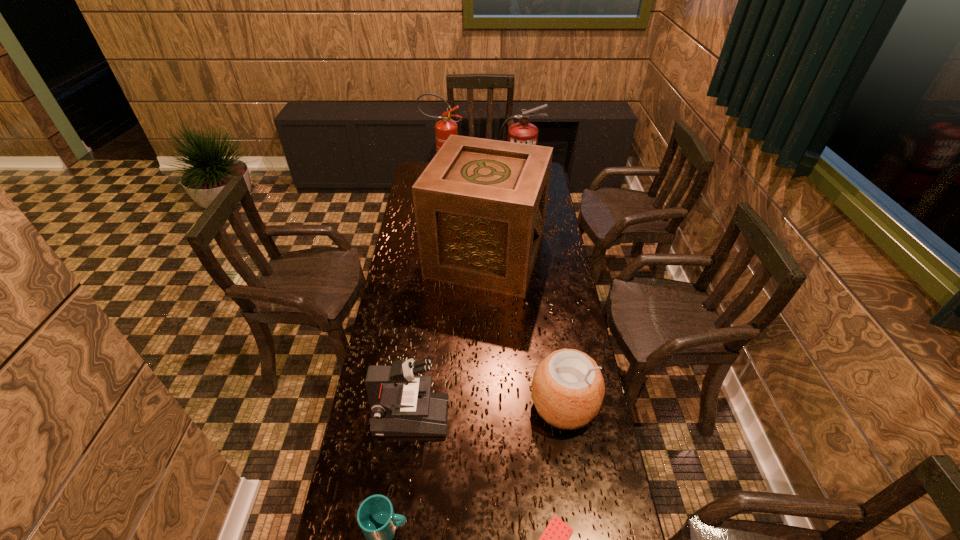
Locate an element on the screen. Image resolution: width=960 pixels, height=540 pixels. the left fire extinguisher is located at coordinates (444, 128).

Locate an element on the screen. The height and width of the screenshot is (540, 960). the right fire extinguisher is located at coordinates (523, 132).

Where is `the fifth nearest object`? Image resolution: width=960 pixels, height=540 pixels. the fifth nearest object is located at coordinates (480, 205).

Identify the location of microscope. click(402, 404).

Locate an element on the screen. This screenshot has height=540, width=960. coconut is located at coordinates (567, 389).

Image resolution: width=960 pixels, height=540 pixels. Identify the location of free space located 0.320m from the nozzle of the left fire extinguisher. (522, 185).

Find the location of a particular element. The width and height of the screenshot is (960, 540). blank area located 0.260m toward the nozzle of the right fire extinguisher is located at coordinates (522, 231).

The width and height of the screenshot is (960, 540). Identify the location of free spot located on the front of the box. (487, 318).

Where is `vacant space located through the eyepieces of the microscope`? vacant space located through the eyepieces of the microscope is located at coordinates (545, 416).

You are a GUI agent. You are given a task and a screenshot of the screen. Output one action in this format:
    pyautogui.click(x=<x>, y=<y>)
    Task: Click on the free space located 0.070m on the left of the coconut
    This screenshot has width=960, height=540.
    Given the screenshot: What is the action you would take?
    pyautogui.click(x=508, y=405)